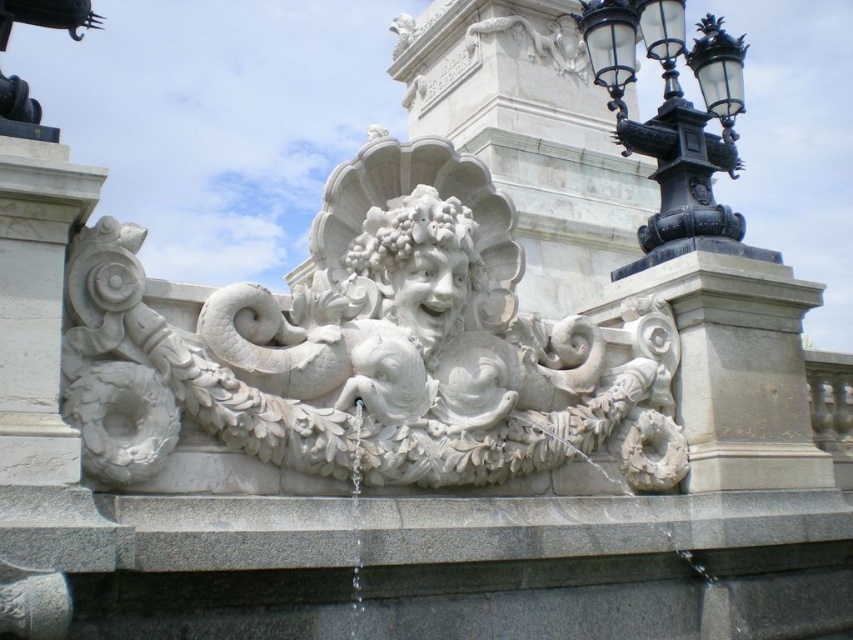
Question: Which point is closer to the camera taking this photo?

Choices:
 (A) tap(219, 483)
 (B) tap(660, 161)
 (C) tap(432, 278)

Answer: (A)

Question: Which object is positioned farthest from the white stone deity at center?

Choices:
 (A) black metal/texture lamp post at upper right
 (B) white marble sculpture at center

Answer: (A)

Question: Does black metal/texture lamp post at upper right appear on the right side of white stone deity at center?

Choices:
 (A) yes
 (B) no

Answer: (A)

Question: Where is white marble sculpture at center located in relation to black metal/texture lamp post at upper right in the image?

Choices:
 (A) above
 (B) below

Answer: (B)

Question: Which point is closer to the camera?

Choices:
 (A) click(650, 477)
 (B) click(419, 232)

Answer: (B)

Question: Is white marble sculpture at center below white stone deity at center?

Choices:
 (A) no
 (B) yes

Answer: (A)